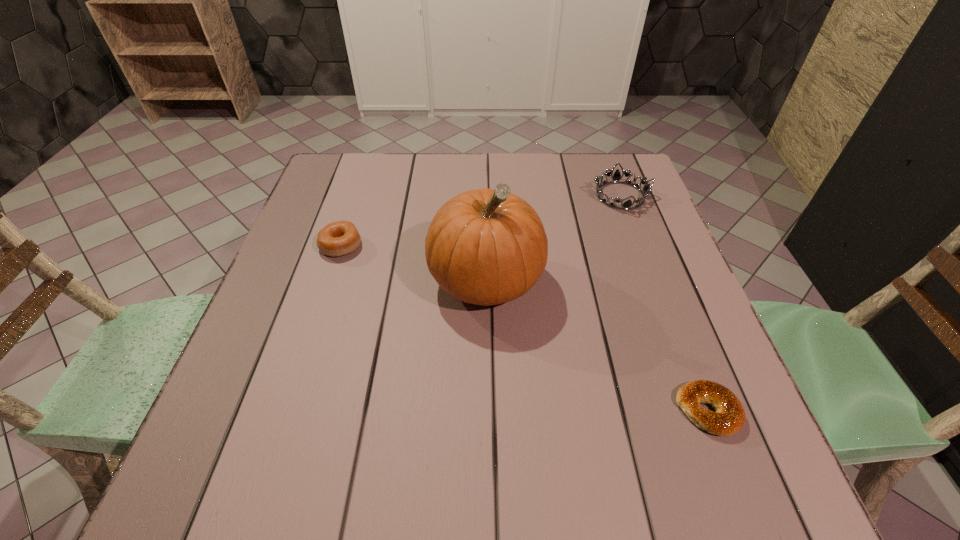
Locate an element on the screen. free region located on the front-facing side of the second tallest object is located at coordinates (451, 196).

Locate an element on the screen. This screenshot has height=540, width=960. vacant space located 0.320m on the front-facing side of the second tallest object is located at coordinates (473, 196).

Identify the location of vacant space located on the front of the leftmost object. The image size is (960, 540). (327, 285).

At what (x,y) coordinates should I click in order to perform the action: click on vacant space located on the front of the right bagel. Please return your answer as a coordinate pair (x, y). The height and width of the screenshot is (540, 960). Looking at the image, I should click on (731, 469).

Identify the location of object at the far edge. (616, 177).

At what (x,y) coordinates should I click in order to perform the action: click on object that is at the left edge. Please return your answer as a coordinate pair (x, y). This screenshot has height=540, width=960. Looking at the image, I should click on (339, 238).

This screenshot has width=960, height=540. I want to click on tiara that is at the right edge, so click(616, 177).

Identify the location of bagel at the right edge. This screenshot has width=960, height=540. (729, 418).

Identify the location of object located at the far right corner. Image resolution: width=960 pixels, height=540 pixels. (616, 177).

Find the location of a particular element. The width and height of the screenshot is (960, 540). vacant point at the far edge is located at coordinates (556, 200).